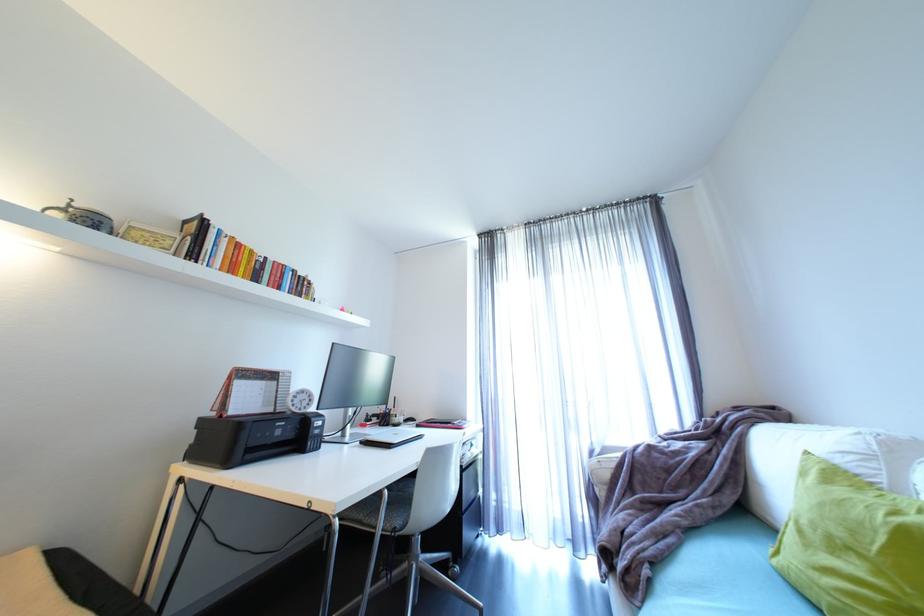
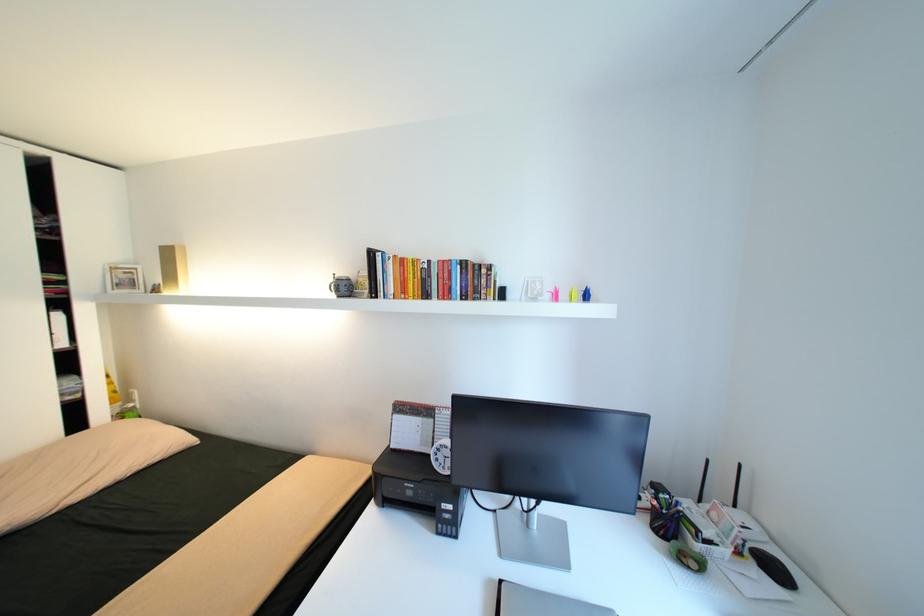
Find the pixel in the second image that matches the point at 282,262 in the first image.

(445, 262)